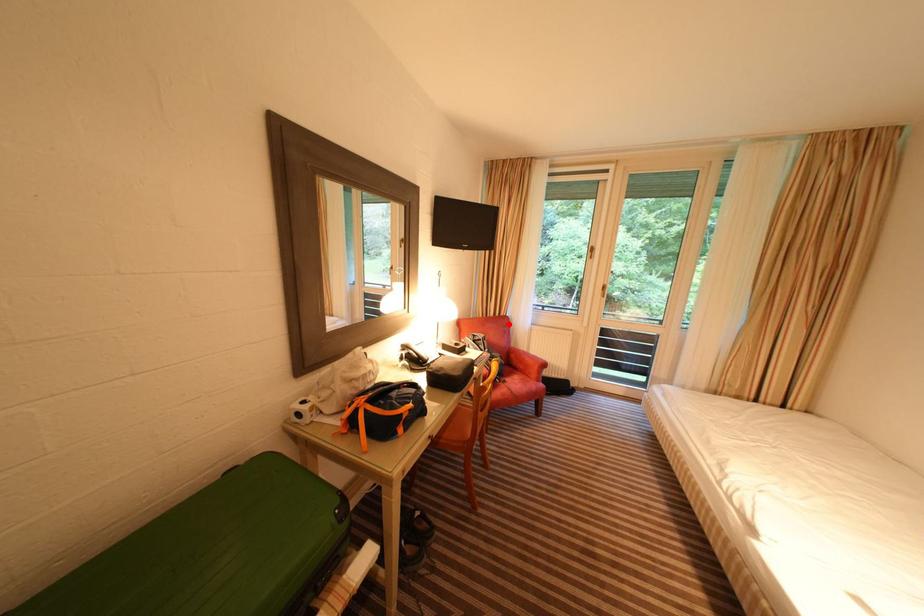
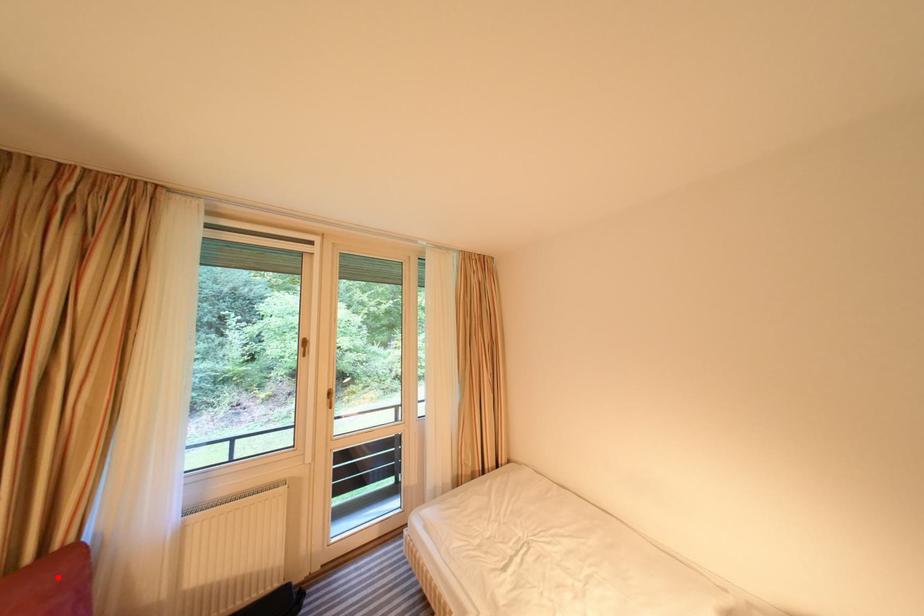
I am providing you with two images of the same scene from different viewpoints. A red point is marked on the first image and another point is marked on the second image. Is the marked point in image1 the same physical position as the marked point in image2?

Yes